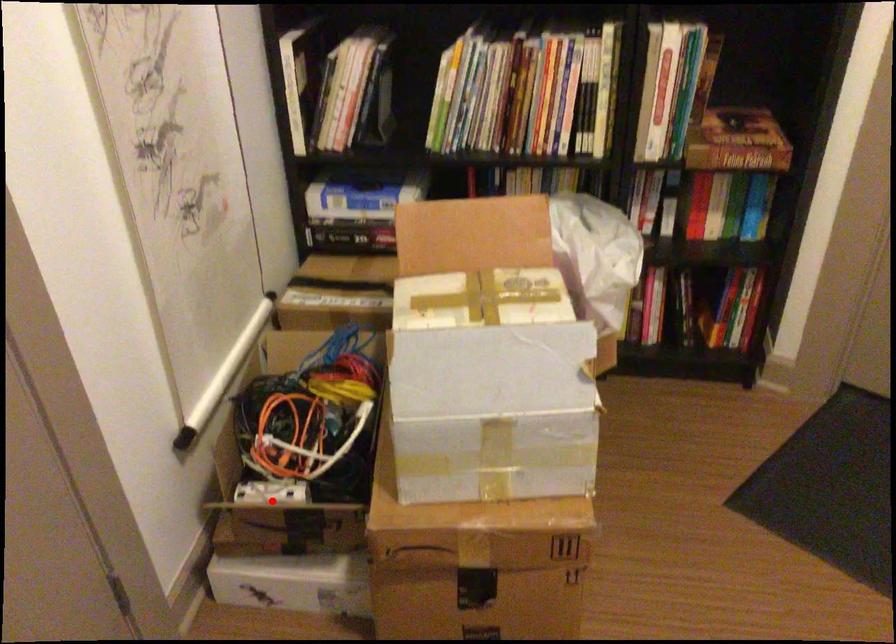
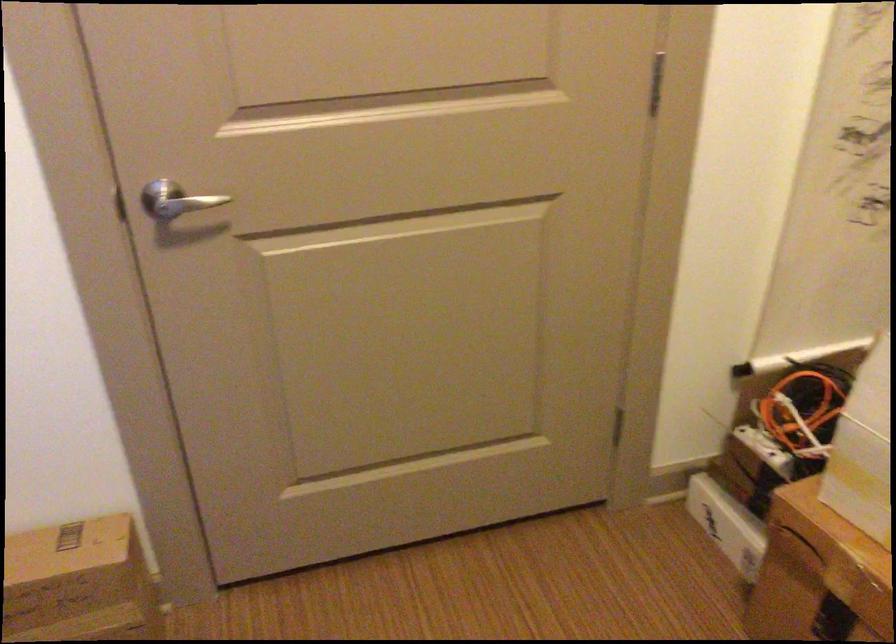
Question: I am providing you with two images of the same scene from different viewpoints. A red point is shown in image1. For the corresponding object point in image2, is it positioned nearer or farther from the camera?

Choices:
 (A) Nearer
 (B) Farther

Answer: (B)